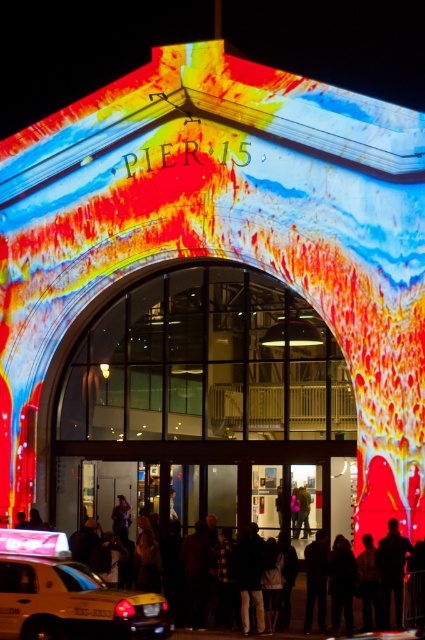
You are a pedestrian standing at the entrance of Pier 15 and want to hail a taxi. Which direction should you look to find the yellow matte taxi at lower left?

The yellow matte taxi at lower left is located at point [68,595], so you should look towards the lower left direction from the entrance to find it.

You are standing at point (31,556) and want to reach the entrance of Pier 15. The entrance is 59.13 meters away from your current position. If you walk at a speed of 1.5 meters per second, how many seconds will it take you to reach the entrance?

To calculate the time required to reach the entrance, divide the distance by the walking speed. 59.13 meters divided by 1.5 meters per second equals approximately 39.42 seconds. Therefore, it will take about 39.42 seconds to reach the entrance.